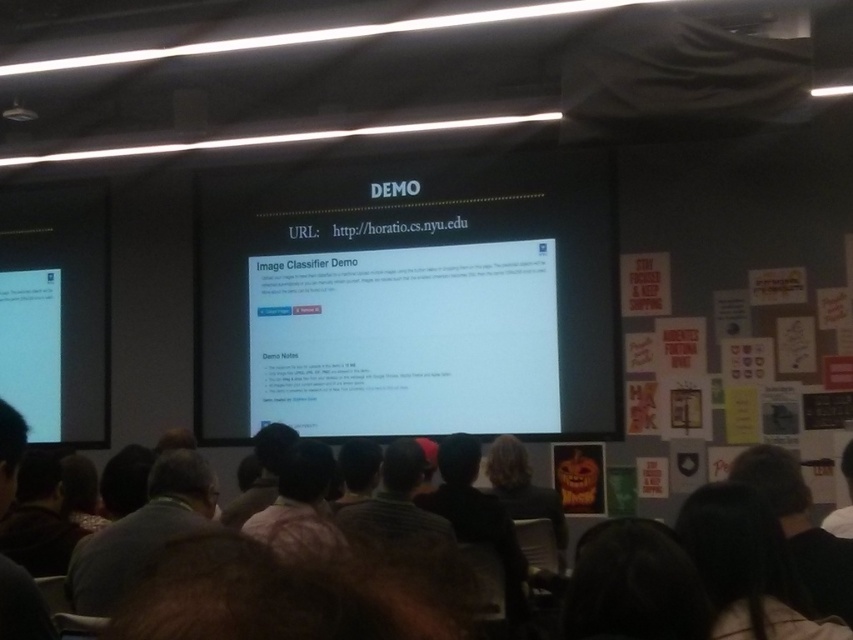
You are a photographer standing in the classroom. You want to take a photo of the dark brown hair at lower right without including anyone else in the frame. Is it possible to do so with a standard camera lens that has a minimum focusing distance of 1.5 meters?

The dark brown hair at lower right is 1.48 meters away from the viewer. Since the minimum focusing distance of the camera lens is 1.5 meters, the photographer cannot focus on the dark brown hair at lower right because it is too close.

You are standing in the classroom and want to reach the point marked as point (x=778, y=624). If your average walking speed is 3 feet per second, how many seconds will it take you to reach that point?

The distance between you and point (x=778, y=624) is 5.01 feet. At a speed of 3 feet per second, it would take approximately 1.67 seconds to reach the point.